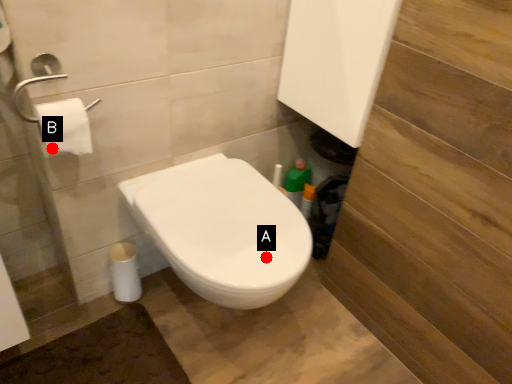
Question: Two points are circled on the image, labeled by A and B beside each circle. Among these points, which one is farthest from the camera?

Choices:
 (A) A is further
 (B) B is further

Answer: (A)